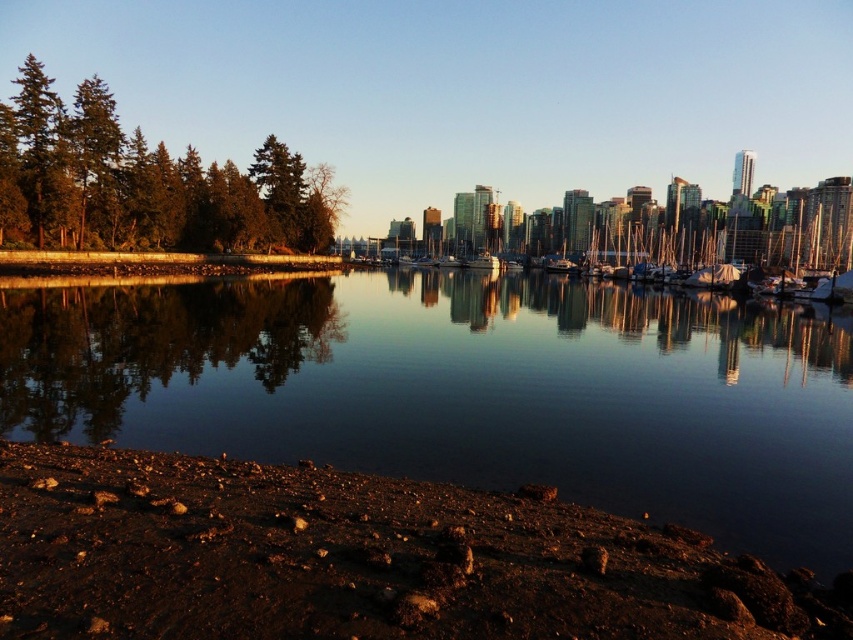
You are standing on the rocky shoreline and want to take a photo of the white glossy boat at center without the green matte trees at left blocking the view. Is this possible?

The green matte trees at left is positioned under white glossy boat at center, so the boat is above the trees in the image. Since the boat is higher up, you can take a photo of the white glossy boat at center without the green matte trees at left blocking the view.

You are a landscape architect designing a walking path between the smooth reflective water at center and the dull brown dirt at lower left. The path must be 60 feet long. Can you safely build the path without exceeding the required length?

The distance between the smooth reflective water at center and the dull brown dirt at lower left is 66.01 feet. Since the required path length is 60 feet, the path would exceed the required length by 6.01 feet. Therefore, the path cannot be built within the specified length.